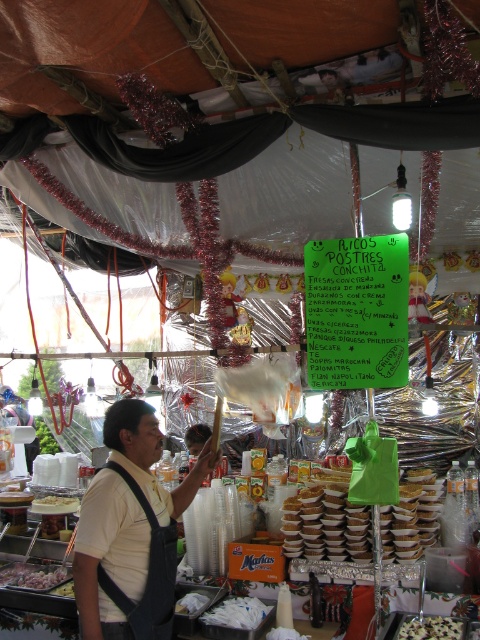
Is white paper cups at center to the left of white glossy onion at lower left from the viewer's perspective?

No, white paper cups at center is not to the left of white glossy onion at lower left.

Which is more to the right, white paper cups at center or white glossy onion at lower left?

From the viewer's perspective, white paper cups at center appears more on the right side.

Which is in front, point (414, 529) or point (6, 586)?

Positioned in front is point (414, 529).

The image size is (480, 640). What are the coordinates of `white paper cups at center` in the screenshot? It's located at (410, 516).

Does white fabric apron at center have a lesser height compared to white creamy pastry at center?

In fact, white fabric apron at center may be taller than white creamy pastry at center.

Is white fabric apron at center below white creamy pastry at center?

No, white fabric apron at center is not below white creamy pastry at center.

Does point (116, 625) come farther from viewer compared to point (444, 621)?

No, (116, 625) is closer to viewer.

The width and height of the screenshot is (480, 640). What are the coordinates of `white fabric apron at center` in the screenshot? It's located at (108, 554).

Does white fabric apron at center have a greater width compared to white paper cups at center?

No, white fabric apron at center is not wider than white paper cups at center.

Between white fabric apron at center and white paper cups at center, which one has more height?

With more height is white fabric apron at center.

Image resolution: width=480 pixels, height=640 pixels. What are the coordinates of `white fabric apron at center` in the screenshot? It's located at (108, 554).

Locate an element on the screen. This screenshot has width=480, height=640. white fabric apron at center is located at coordinates click(108, 554).